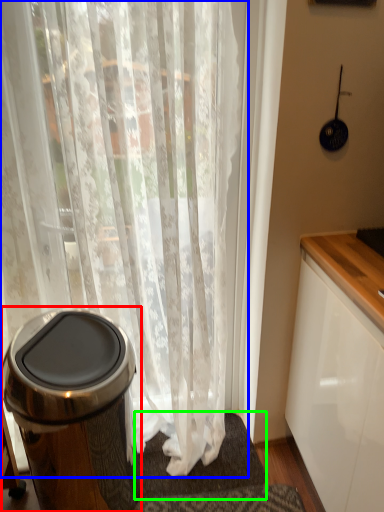
Question: Based on their relative distances, which object is nearer to waste container (highlighted by a red box)? Choose from curtain (highlighted by a blue box) and bath mat (highlighted by a green box).

Choices:
 (A) curtain
 (B) bath mat

Answer: (A)